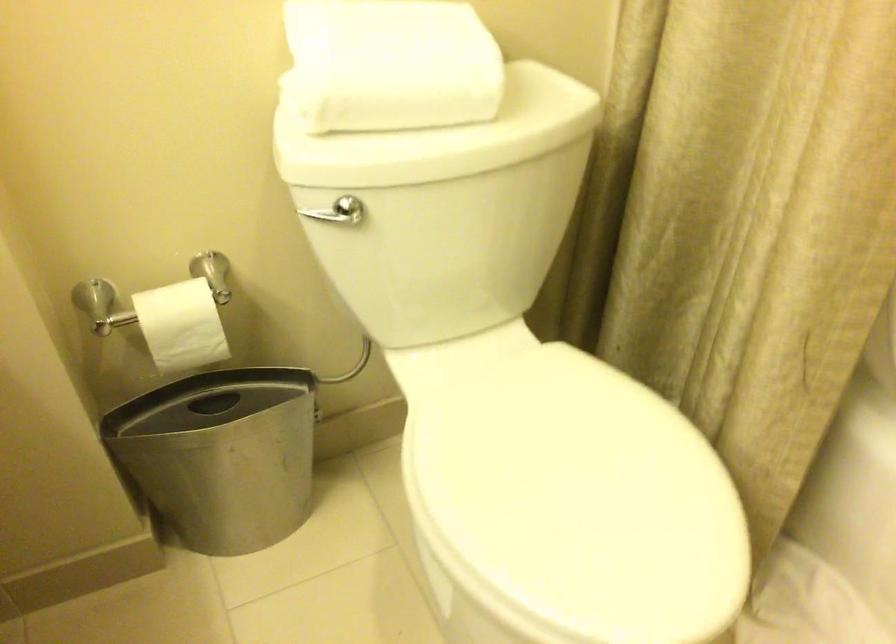
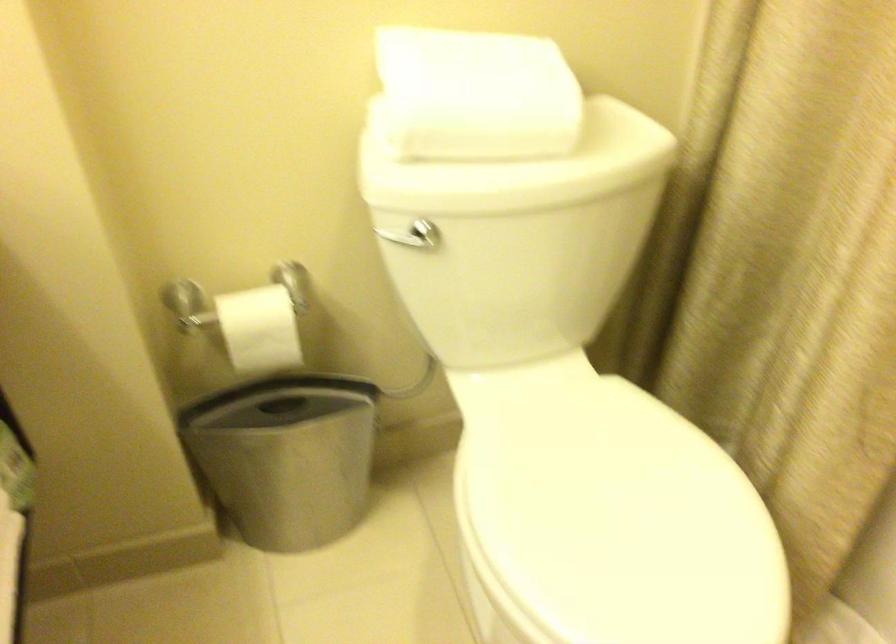
Question: What movement of the cameraman would produce the second image?

Choices:
 (A) Left
 (B) Right
 (C) Forward
 (D) Backward

Answer: (D)